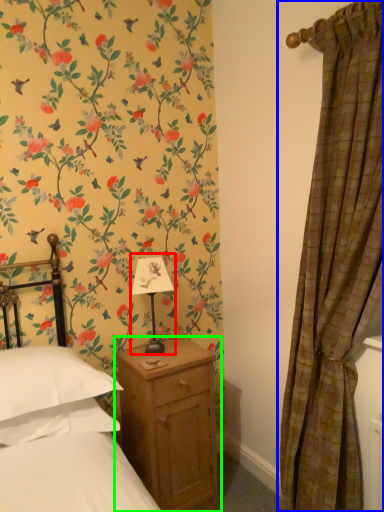
Question: Which object is the closest to the table lamp (highlighted by a red box)? Choose among these: curtain (highlighted by a blue box) or nightstand (highlighted by a green box).

Choices:
 (A) curtain
 (B) nightstand

Answer: (B)